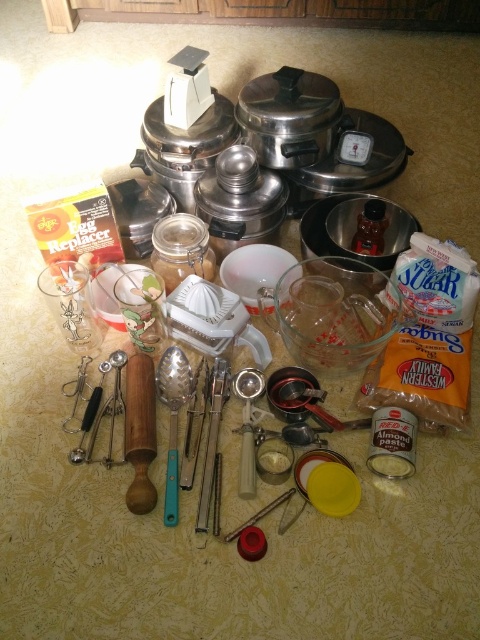
You are standing in the kitchen and want to grab the teal plastic spoon at center. Based on the coordinates provided, can you confirm if the point at [172,419] is where you should reach to get it?

Yes, the point at [172,419] corresponds to the teal plastic spoon at center, so reaching there will allow you to grab it.

From the picture: You are preparing to bake a cake and need to measure ingredients. You have a metallic silver measuring cup at center and silver metallic utensils at center on the countertop. Which item is shorter and better suited for precise measurements?

The metallic silver measuring cup at center is shorter than the silver metallic utensils at center, making it better suited for precise measurements.